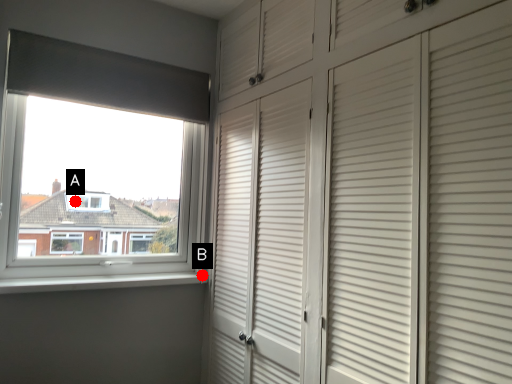
Question: Two points are circled on the image, labeled by A and B beside each circle. Which point is closer to the camera taking this photo?

Choices:
 (A) A is closer
 (B) B is closer

Answer: (A)